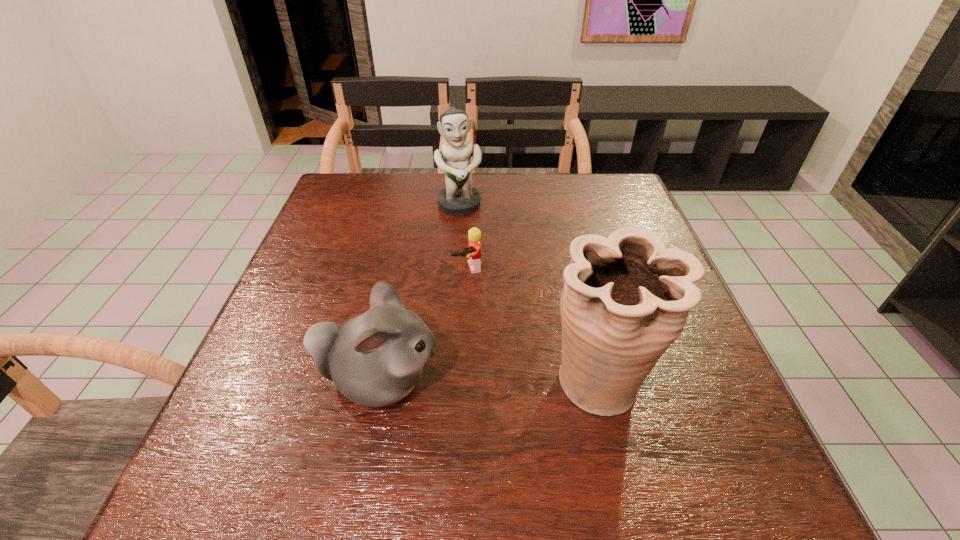
You are a GUI agent. You are given a task and a screenshot of the screen. Output one action in this format:
    pyautogui.click(x=<x>, y=<y>)
    Task: Click on the vacant space situated 0.230m in front of the Lego with the accessory visible
    
    Given the screenshot: What is the action you would take?
    pyautogui.click(x=498, y=359)

Image resolution: width=960 pixels, height=540 pixels. I want to click on vacant space located 0.380m in front of the Lego with the accessory visible, so click(x=523, y=427).

The width and height of the screenshot is (960, 540). I want to click on vacant space situated 0.280m in front of the Lego with the accessory visible, so click(506, 380).

Locate an element on the screen. The image size is (960, 540). object that is at the far edge is located at coordinates (459, 198).

Identify the location of hamster present at the near edge. The image size is (960, 540). (375, 359).

This screenshot has height=540, width=960. I want to click on urn at the near edge, so click(626, 298).

I want to click on object that is at the left edge, so click(375, 359).

Locate an element on the screen. object that is at the right edge is located at coordinates (x=626, y=298).

What are the coordinates of `object that is at the near left corner` in the screenshot? It's located at (375, 359).

Where is `object situated at the near right corner`? object situated at the near right corner is located at coordinates (626, 298).